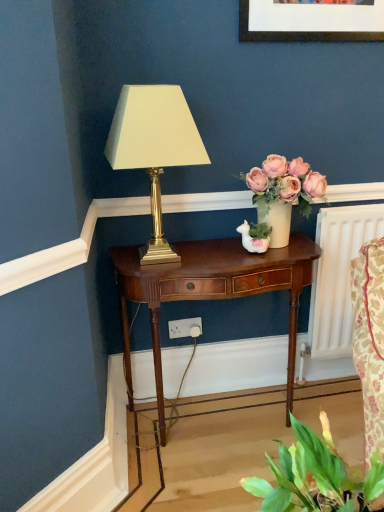
The image size is (384, 512). What do you see at coordinates (283, 193) in the screenshot?
I see `matte cream vase with pink roses at center` at bounding box center [283, 193].

What do you see at coordinates (154, 148) in the screenshot? I see `gold metallic lamp at center` at bounding box center [154, 148].

Image resolution: width=384 pixels, height=512 pixels. In order to click on green leafy plant at lower right in this screenshot , I will do `click(313, 474)`.

Locate an element on the screen. matte cream vase with pink roses at center is located at coordinates (283, 193).

In the scene shown: Considering the relative sizes of matte cream vase with pink roses at center and mahogany wood nightstand at center in the image provided, is matte cream vase with pink roses at center thinner than mahogany wood nightstand at center?

Yes.

Locate an element on the screen. This screenshot has width=384, height=512. nightstand in front of the matte cream vase with pink roses at center is located at coordinates (211, 290).

From the image's perspective, would you say matte cream vase with pink roses at center is positioned over mahogany wood nightstand at center?

Yes, from the image's perspective, matte cream vase with pink roses at center is above mahogany wood nightstand at center.

Is matte cream vase with pink roses at center inside the boundaries of mahogany wood nightstand at center, or outside?

matte cream vase with pink roses at center is not enclosed by mahogany wood nightstand at center.

Is gold metallic lamp at center surrounded by matte cream vase with pink roses at center?

That's incorrect, gold metallic lamp at center is not inside matte cream vase with pink roses at center.

Could you tell me if matte cream vase with pink roses at center is turned towards gold metallic lamp at center?

No, matte cream vase with pink roses at center is not facing towards gold metallic lamp at center.

Which of these two, matte cream vase with pink roses at center or gold metallic lamp at center, is smaller?

Smaller between the two is matte cream vase with pink roses at center.

Is matte cream vase with pink roses at center beside gold metallic lamp at center?

No, matte cream vase with pink roses at center is not making contact with gold metallic lamp at center.

Consider the image. From a real-world perspective, is matte cream vase with pink roses at center physically above green leafy plant at lower right?

Yes, from a real-world perspective, matte cream vase with pink roses at center is on top of green leafy plant at lower right.

Image resolution: width=384 pixels, height=512 pixels. In order to click on floral arrangement located behind the green leafy plant at lower right in this screenshot , I will do `click(283, 193)`.

Considering the sizes of objects matte cream vase with pink roses at center and green leafy plant at lower right in the image provided, who is bigger, matte cream vase with pink roses at center or green leafy plant at lower right?

With larger size is matte cream vase with pink roses at center.

Which of these two, green leafy plant at lower right or matte cream vase with pink roses at center, stands shorter?

Standing shorter between the two is green leafy plant at lower right.

Is green leafy plant at lower right located outside matte cream vase with pink roses at center?

green leafy plant at lower right lies outside matte cream vase with pink roses at center's area.

Where is `houseplant in front of the matte cream vase with pink roses at center`? Image resolution: width=384 pixels, height=512 pixels. houseplant in front of the matte cream vase with pink roses at center is located at coordinates (313, 474).

Considering the relative positions of green leafy plant at lower right and matte cream vase with pink roses at center in the image provided, is green leafy plant at lower right in front of matte cream vase with pink roses at center?

Yes, the depth of green leafy plant at lower right is less than that of matte cream vase with pink roses at center.

Where is `nightstand below the gold metallic lamp at center (from a real-world perspective)`? nightstand below the gold metallic lamp at center (from a real-world perspective) is located at coordinates (211, 290).

Considering the points (191, 124) and (200, 292), which point is behind, point (191, 124) or point (200, 292)?

The point (200, 292) is more distant.

Is gold metallic lamp at center further to the viewer compared to mahogany wood nightstand at center?

No, it is in front of mahogany wood nightstand at center.

Is gold metallic lamp at center looking in the opposite direction of green leafy plant at lower right?

No, green leafy plant at lower right is not at the back of gold metallic lamp at center.

Consider the image. Is gold metallic lamp at center thinner than green leafy plant at lower right?

No, gold metallic lamp at center is not thinner than green leafy plant at lower right.

Are gold metallic lamp at center and green leafy plant at lower right located far from each other?

No, there isn't a large distance between gold metallic lamp at center and green leafy plant at lower right.

Is point (139, 159) in front of point (304, 490)?

No.

Which of these two, gold metallic lamp at center or matte cream vase with pink roses at center, is thinner?

With smaller width is matte cream vase with pink roses at center.

Considering the sizes of gold metallic lamp at center and matte cream vase with pink roses at center in the image, is gold metallic lamp at center bigger or smaller than matte cream vase with pink roses at center?

Clearly, gold metallic lamp at center is larger in size than matte cream vase with pink roses at center.

Considering the points (143, 264) and (284, 175), which point is behind, point (143, 264) or point (284, 175)?

The point (284, 175) is more distant.

From a real-world perspective, is gold metallic lamp at center positioned above or below matte cream vase with pink roses at center?

gold metallic lamp at center is above matte cream vase with pink roses at center.

In order to click on floral arrangement behind the mahogany wood nightstand at center in this screenshot , I will do `click(283, 193)`.

Identify the location of floral arrangement located below the gold metallic lamp at center (from the image's perspective). (283, 193).

Based on their spatial positions, is green leafy plant at lower right or gold metallic lamp at center closer to mahogany wood nightstand at center?

gold metallic lamp at center.

Which object lies further to the anchor point matte cream vase with pink roses at center, gold metallic lamp at center or green leafy plant at lower right?

The object further to matte cream vase with pink roses at center is green leafy plant at lower right.

Based on their spatial positions, is gold metallic lamp at center or mahogany wood nightstand at center closer to matte cream vase with pink roses at center?

mahogany wood nightstand at center is positioned closer to the anchor matte cream vase with pink roses at center.

Which object lies nearer to the anchor point green leafy plant at lower right, matte cream vase with pink roses at center or gold metallic lamp at center?

matte cream vase with pink roses at center.

From the image, which object appears to be nearer to mahogany wood nightstand at center, gold metallic lamp at center or matte cream vase with pink roses at center?

Among the two, matte cream vase with pink roses at center is located nearer to mahogany wood nightstand at center.

Which object lies further to the anchor point green leafy plant at lower right, mahogany wood nightstand at center or gold metallic lamp at center?

gold metallic lamp at center is further to green leafy plant at lower right.

Estimate the real-world distances between objects in this image. Which object is further from gold metallic lamp at center, matte cream vase with pink roses at center or mahogany wood nightstand at center?

The object further to gold metallic lamp at center is matte cream vase with pink roses at center.

Looking at the image, which one is located closer to mahogany wood nightstand at center, matte cream vase with pink roses at center or green leafy plant at lower right?

matte cream vase with pink roses at center is positioned closer to the anchor mahogany wood nightstand at center.

This screenshot has height=512, width=384. In order to click on floral arrangement that lies between gold metallic lamp at center and mahogany wood nightstand at center from top to bottom in this screenshot , I will do `click(283, 193)`.

Where is `lamp located between green leafy plant at lower right and matte cream vase with pink roses at center in the depth direction`? lamp located between green leafy plant at lower right and matte cream vase with pink roses at center in the depth direction is located at coordinates (154, 148).

At what (x,y) coordinates should I click in order to perform the action: click on nightstand between green leafy plant at lower right and matte cream vase with pink roses at center along the z-axis. Please return your answer as a coordinate pair (x, y). Looking at the image, I should click on (211, 290).

At what (x,y) coordinates should I click in order to perform the action: click on lamp between green leafy plant at lower right and mahogany wood nightstand at center in the front-back direction. Please return your answer as a coordinate pair (x, y). The image size is (384, 512). Looking at the image, I should click on (154, 148).